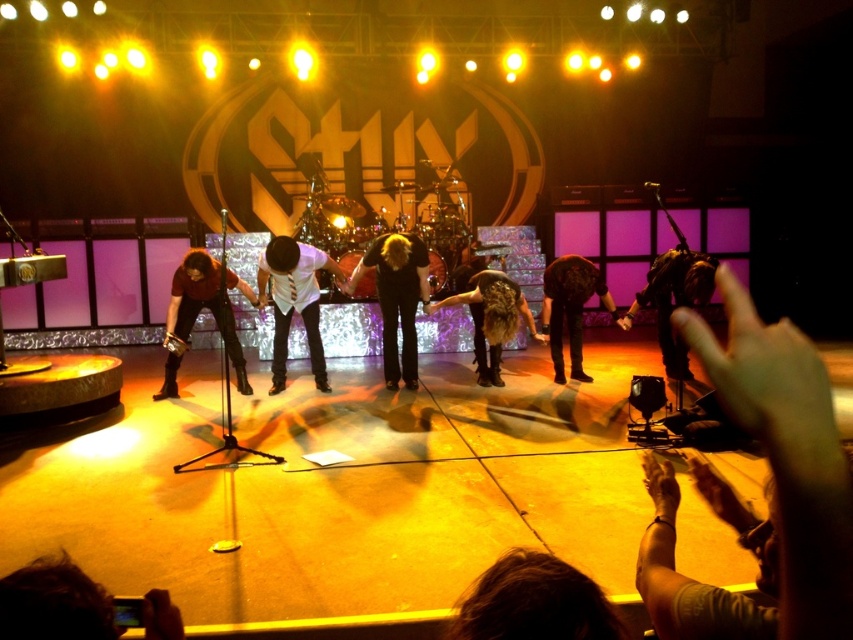
Who is lower down, dark brown leather jacket at right or shiny brown hair at center?

shiny brown hair at center is lower down.

Where is `dark brown leather jacket at right`? dark brown leather jacket at right is located at coordinates (674, 300).

Is point (206, 257) farther from camera compared to point (476, 320)?

No, (206, 257) is closer to viewer.

Is point (212, 269) positioned behind point (509, 337)?

Yes, it is behind point (509, 337).

Locate an element on the screen. The width and height of the screenshot is (853, 640). matte brown leather jacket at lower left is located at coordinates click(198, 312).

Who is lower down, shiny brown hair at center or leather jacket at center?

Positioned lower is shiny brown hair at center.

Which of these two, shiny brown hair at center or leather jacket at center, stands shorter?

shiny brown hair at center

Does point (492, 330) come closer to viewer compared to point (585, 268)?

Yes, it is in front of point (585, 268).

Image resolution: width=853 pixels, height=640 pixels. I want to click on shiny brown hair at center, so click(491, 317).